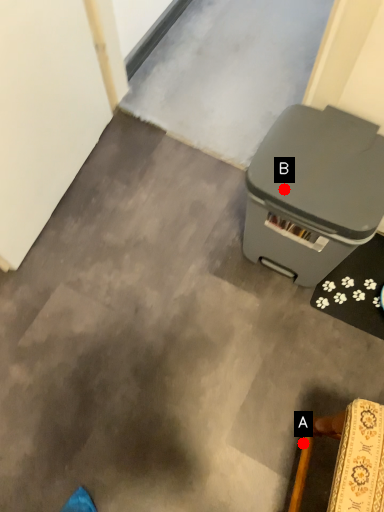
Question: Two points are circled on the image, labeled by A and B beside each circle. Which point appears farthest from the camera in this image?

Choices:
 (A) A is further
 (B) B is further

Answer: (A)